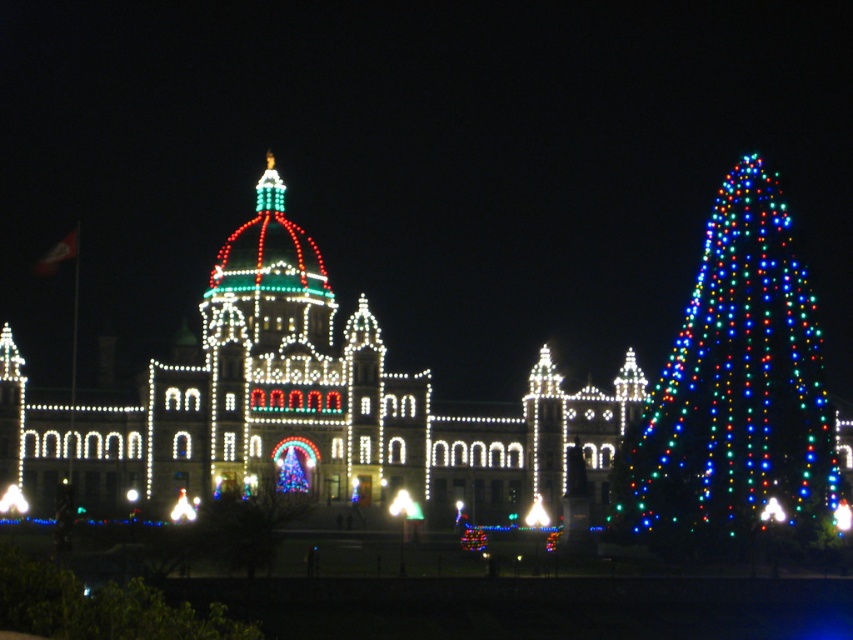
Can you confirm if illuminated stone building at center is taller than illuminated plastic tree at center?

Indeed, illuminated stone building at center has a greater height compared to illuminated plastic tree at center.

Can you confirm if illuminated stone building at center is positioned above illuminated plastic tree at center?

Yes.

Does point (88, 493) come behind point (277, 528)?

That is True.

Locate an element on the screen. illuminated stone building at center is located at coordinates (303, 406).

Does multicolored lights christmas tree at right come in front of illuminated plastic tree at center?

No, it is not.

Which is behind, point (833, 440) or point (201, 531)?

Positioned behind is point (833, 440).

You are a GUI agent. You are given a task and a screenshot of the screen. Output one action in this format:
    pyautogui.click(x=<x>, y=<y>)
    Task: Click on the multicolored lights christmas tree at right
    This screenshot has height=640, width=853.
    Given the screenshot: What is the action you would take?
    pyautogui.click(x=735, y=394)

Which is behind, point (506, 516) or point (753, 177)?

Positioned behind is point (506, 516).

Can you confirm if illuminated stone building at center is thinner than multicolored lights christmas tree at right?

In fact, illuminated stone building at center might be wider than multicolored lights christmas tree at right.

Who is more forward, (346, 337) or (730, 205)?

Positioned in front is point (730, 205).

What are the coordinates of `illuminated stone building at center` in the screenshot? It's located at (303, 406).